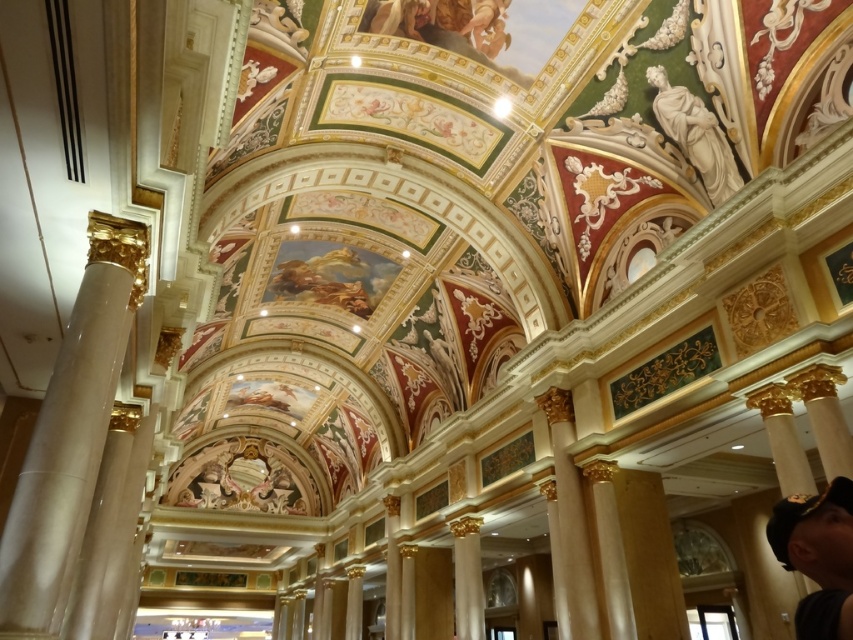
You are an interior designer assessing the space. You need to determine if the black fabric cap at lower right can be placed on top of the white marble statue at upper right without exceeding the ceiling height. Can it be done?

The black fabric cap at lower right is shorter than the white marble statue at upper right, so placing it on top would not exceed the ceiling height as the combined height would still be within limits.

You are an event planner setting up a photo shoot in this grand hall. You want to position a large camera 2 meters wide between the black fabric cap at lower right and the white marble statue at upper right. Is there enough space between them for the camera?

The black fabric cap at lower right and the white marble statue at upper right are 12.28 meters apart, so there is sufficient space to place the 2 meters wide camera between them.